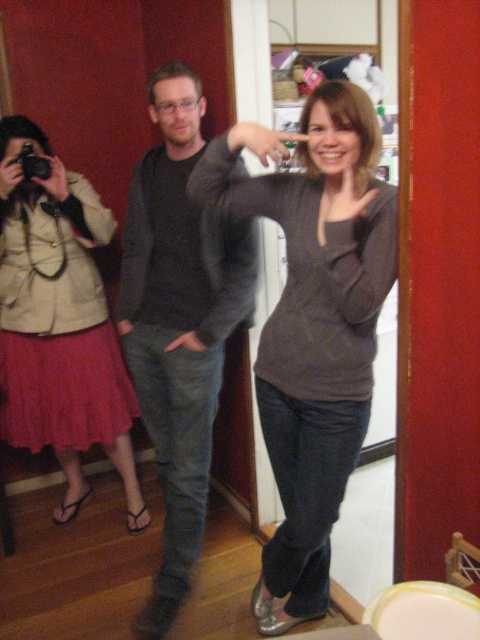
What do you see at coordinates (181, 317) in the screenshot?
I see `matte gray sweater at center` at bounding box center [181, 317].

Does point (358, 282) come closer to viewer compared to point (195, 477)?

Yes, point (358, 282) is closer to viewer.

Is point (168, 568) farther from camera compared to point (156, 182)?

No.

At what (x,y) coordinates should I click in order to perform the action: click on matte gray sweater at center. Please return your answer as a coordinate pair (x, y). This screenshot has height=640, width=480. Looking at the image, I should click on (181, 317).

Is point (181, 173) positioned before point (48, 234)?

Yes.

Based on the photo, between dark gray sweater at center and matte beige jacket at left, which one has less height?

matte beige jacket at left is shorter.

You are a GUI agent. You are given a task and a screenshot of the screen. Output one action in this format:
    pyautogui.click(x=<x>, y=<y>)
    Task: Click on the dark gray sweater at center
    
    Given the screenshot: What is the action you would take?
    pyautogui.click(x=180, y=323)

Locate an element on the screen. This screenshot has width=480, height=640. matte gray sweater at center is located at coordinates (181, 317).

Which is above, matte gray sweater at center or matte beige jacket at left?

Positioned higher is matte beige jacket at left.

Where is `matte gray sweater at center`? The width and height of the screenshot is (480, 640). matte gray sweater at center is located at coordinates (181, 317).